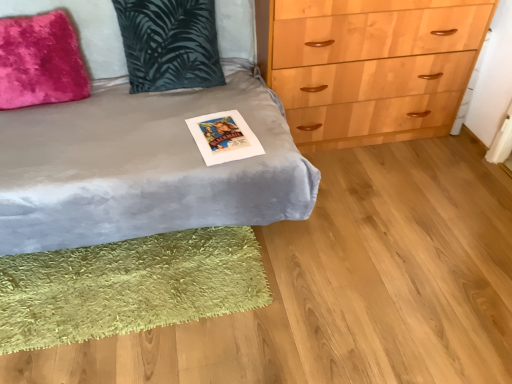
Question: Can you confirm if velvet gray bed at center is wider than matte paper postcard at center?

Choices:
 (A) no
 (B) yes

Answer: (B)

Question: Can you confirm if velvet gray bed at center is thinner than matte paper postcard at center?

Choices:
 (A) yes
 (B) no

Answer: (B)

Question: Does velvet gray bed at center lie in front of matte paper postcard at center?

Choices:
 (A) yes
 (B) no

Answer: (A)

Question: Is matte paper postcard at center a part of velvet gray bed at center?

Choices:
 (A) yes
 (B) no

Answer: (A)

Question: Would you consider velvet gray bed at center to be distant from matte paper postcard at center?

Choices:
 (A) yes
 (B) no

Answer: (B)

Question: Based on their sizes in the image, would you say green shaggy rug at lower left is bigger or smaller than matte paper postcard at center?

Choices:
 (A) small
 (B) big

Answer: (B)

Question: From a real-world perspective, is green shaggy rug at lower left above or below matte paper postcard at center?

Choices:
 (A) above
 (B) below

Answer: (B)

Question: In terms of width, does green shaggy rug at lower left look wider or thinner when compared to matte paper postcard at center?

Choices:
 (A) wide
 (B) thin

Answer: (A)

Question: From their relative heights in the image, would you say green shaggy rug at lower left is taller or shorter than matte paper postcard at center?

Choices:
 (A) tall
 (B) short

Answer: (A)

Question: In the image, is velvety dark green pillow at upper left, the first pillow when ordered from right to left, positioned in front of or behind fuzzy pink pillow at upper left, the 1th pillow positioned from the left?

Choices:
 (A) front
 (B) behind

Answer: (B)

Question: Visually, is velvety dark green pillow at upper left, the first pillow when ordered from right to left, positioned to the left or to the right of fuzzy pink pillow at upper left, the 1th pillow positioned from the left?

Choices:
 (A) right
 (B) left

Answer: (A)

Question: Is point (218, 61) positioned closer to the camera than point (42, 84)?

Choices:
 (A) closer
 (B) farther

Answer: (B)

Question: Which is correct: velvety dark green pillow at upper left, the first pillow when ordered from right to left, is inside fuzzy pink pillow at upper left, the 1th pillow positioned from the left, or outside of it?

Choices:
 (A) inside
 (B) outside

Answer: (B)

Question: Is point (194, 117) closer or farther from the camera than point (181, 152)?

Choices:
 (A) closer
 (B) farther

Answer: (B)

Question: Relative to velvet gray bed at center, is matte paper postcard at center in front or behind?

Choices:
 (A) behind
 (B) front

Answer: (A)